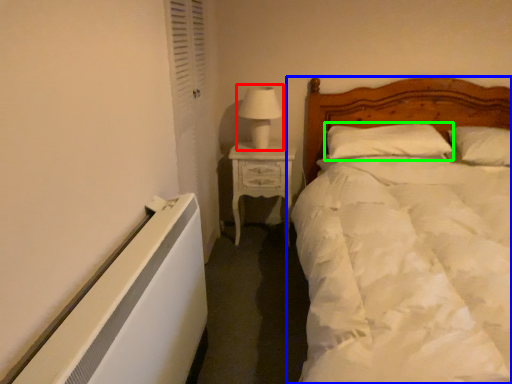
Question: Which object is positioned farthest from table lamp (highlighted by a red box)? Select from bed (highlighted by a blue box) and pillow (highlighted by a green box).

Choices:
 (A) bed
 (B) pillow

Answer: (A)